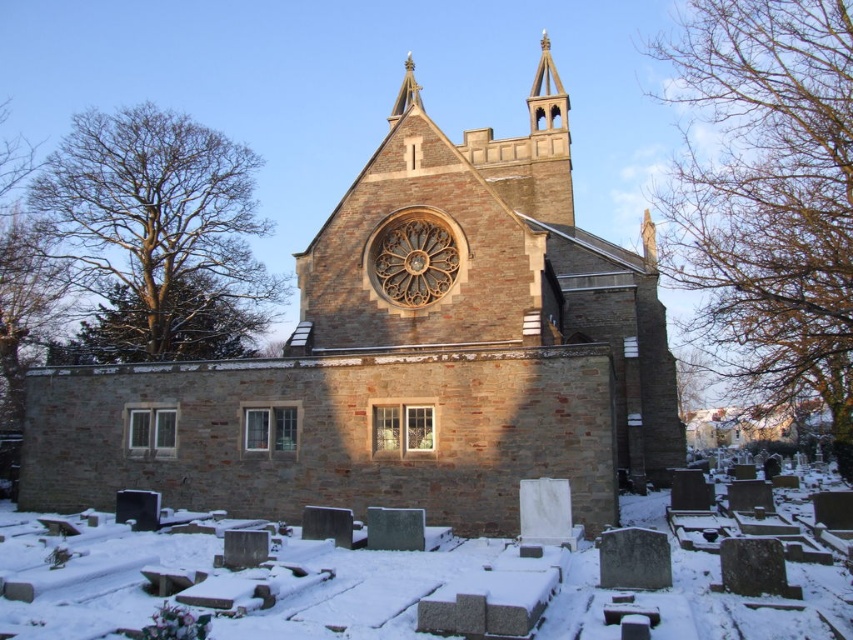
Question: Which point is farther from the camera taking this photo?

Choices:
 (A) (361, 570)
 (B) (344, 257)

Answer: (B)

Question: Is brown stone church at center smaller than white textured snow at center?

Choices:
 (A) no
 (B) yes

Answer: (A)

Question: Can you confirm if brown stone church at center is smaller than white textured snow at center?

Choices:
 (A) yes
 (B) no

Answer: (B)

Question: Can you confirm if brown stone church at center is positioned to the left of white textured snow at center?

Choices:
 (A) no
 (B) yes

Answer: (A)

Question: Which object is closer to the camera taking this photo?

Choices:
 (A) brown stone church at center
 (B) white textured snow at center

Answer: (B)